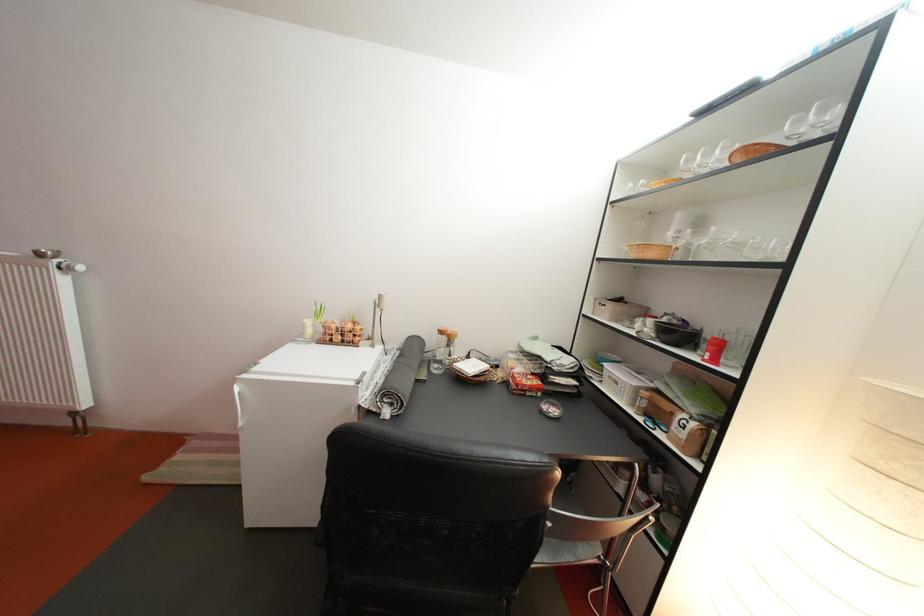
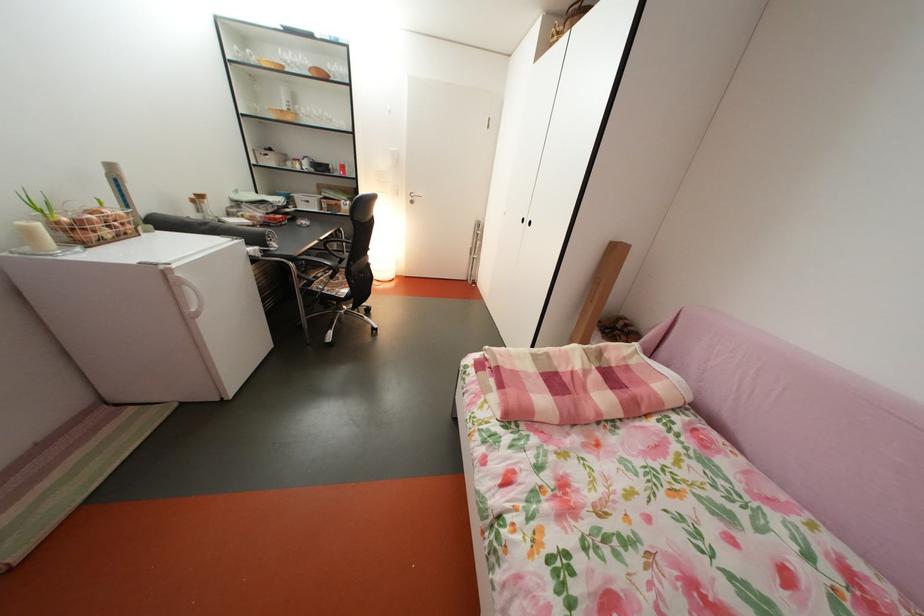
Question: I am providing you with two images of the same scene from different viewpoints. Which of the following objects are not visible in image2?

Choices:
 (A) silver door handle
 (B) black cabinet handle
 (C) white candle
 (D) none of these

Answer: (D)